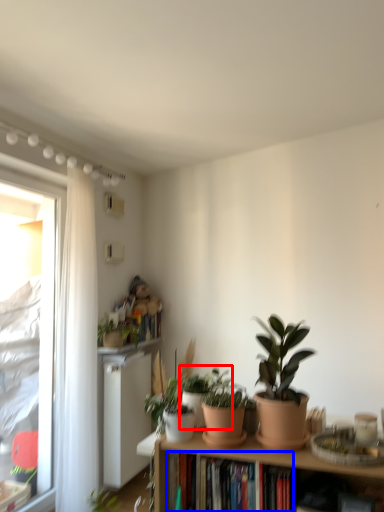
Question: Among these objects, which one is nearest to the camera, houseplant (highlighted by a red box) or book (highlighted by a blue box)?

Choices:
 (A) houseplant
 (B) book

Answer: (B)